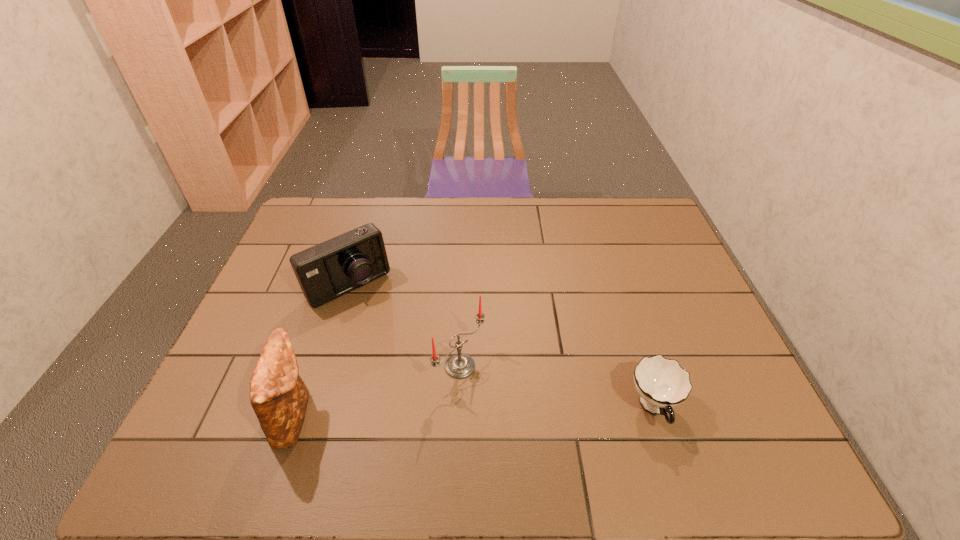
Where is `vacant spot on the desktop that is between the clutch bag and the cup and is positioned on the front-facing side of the camera`? vacant spot on the desktop that is between the clutch bag and the cup and is positioned on the front-facing side of the camera is located at coordinates (440, 413).

At what (x,y) coordinates should I click in order to perform the action: click on free space on the desktop that is between the clutch bag and the rightmost object and is positioned on the front-facing side of the candle. Please return your answer as a coordinate pair (x, y). The image size is (960, 540). Looking at the image, I should click on (528, 411).